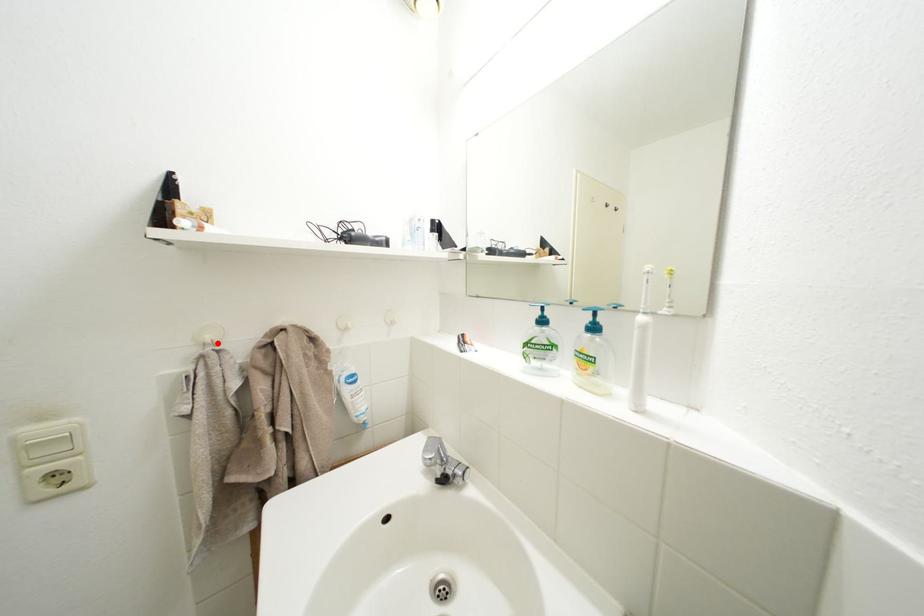
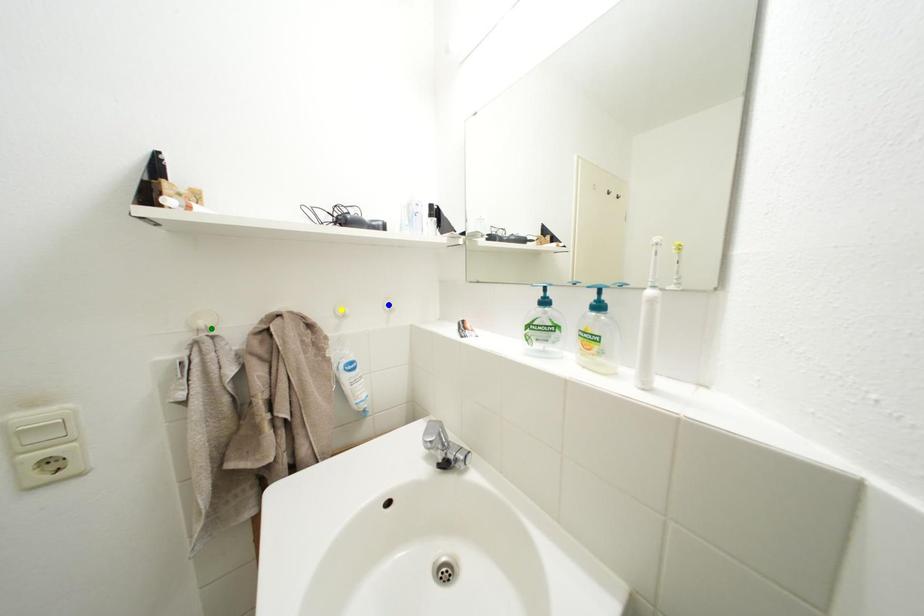
Question: I am providing you with two images of the same scene from different viewpoints. A red point is marked on the first image. You are given multiple points on the second image. Which point in image 2 represents the same 3d spot as the red point in image 1?

Choices:
 (A) green point
 (B) blue point
 (C) yellow point

Answer: (A)